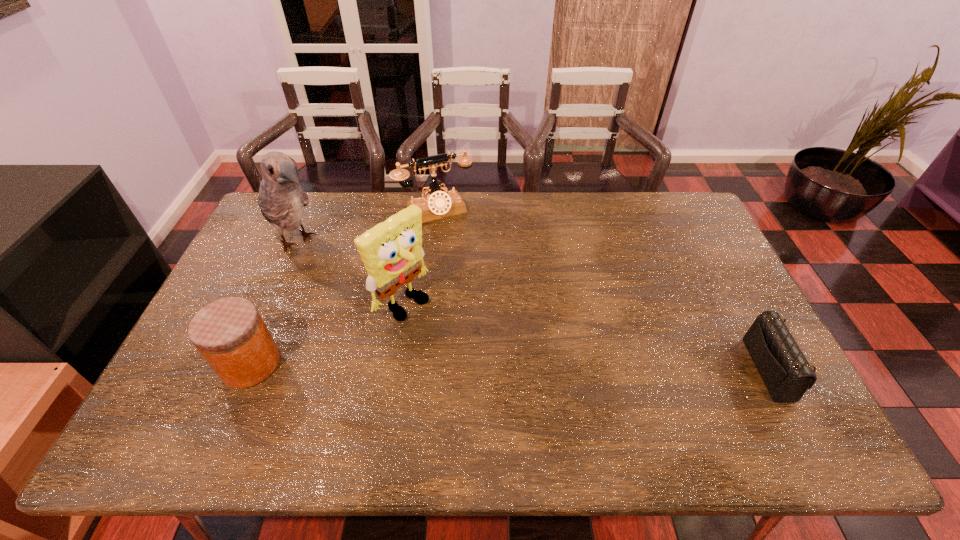
Locate an element on the screen. This screenshot has height=540, width=960. free space that is in between the fourth shortest object and the parrot is located at coordinates (350, 272).

Locate an element on the screen. The image size is (960, 540). free space between the parrot and the jar is located at coordinates (275, 302).

The width and height of the screenshot is (960, 540). I want to click on object that is the fourth closest to the tallest object, so (x=786, y=373).

Locate which object is the second closest to the parrot. Please provide its 2D coordinates. Your answer should be formatted as a tuple, i.e. [(x, y)], where the tuple contains the x and y coordinates of a point satisfying the conditions above.

[(391, 251)]

Locate an element on the screen. free region that satisfies the following two spatial constraints: 1. on the front side of the fourth shortest object; 2. on the front flap of the shortest object is located at coordinates coord(393,369).

Identify the location of free spot that satisfies the following two spatial constraints: 1. on the back side of the telephone; 2. on the right side of the tallest object. This screenshot has height=540, width=960. (312, 210).

Where is `vacant space that satisfies the following two spatial constraints: 1. on the front side of the tallest object; 2. on the right side of the jar`? The width and height of the screenshot is (960, 540). vacant space that satisfies the following two spatial constraints: 1. on the front side of the tallest object; 2. on the right side of the jar is located at coordinates (246, 363).

I want to click on free space that satisfies the following two spatial constraints: 1. on the front side of the tallest object; 2. on the front flap of the shortest object, so click(243, 369).

Find the location of `vacant space that satisfies the following two spatial constraints: 1. on the back side of the telephone; 2. on the right side of the tallest object`. vacant space that satisfies the following two spatial constraints: 1. on the back side of the telephone; 2. on the right side of the tallest object is located at coordinates (312, 210).